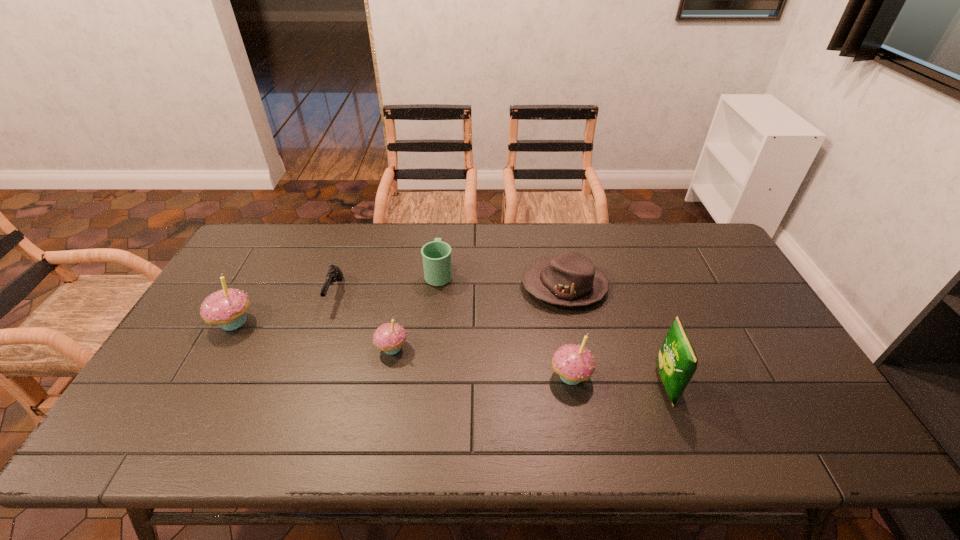
Find the location of `free point located 0.250m on the back of the leftmost cupcake`. free point located 0.250m on the back of the leftmost cupcake is located at coordinates (272, 254).

Where is `free space located on the right of the third object from left to right`? free space located on the right of the third object from left to right is located at coordinates (538, 348).

This screenshot has height=540, width=960. Identify the location of blank space located on the back of the rightmost cupcake. (552, 272).

Identify the location of free location located at the end of the barrel of the gun. (297, 402).

You are a GUI agent. You are given a task and a screenshot of the screen. Output one action in this format:
    pyautogui.click(x=<x>, y=<y>)
    Task: Click on the free location located 0.130m on the side of the mug with the handle
    
    Given the screenshot: What is the action you would take?
    pyautogui.click(x=443, y=237)

You are a GUI agent. You are given a task and a screenshot of the screen. Output one action in this format:
    pyautogui.click(x=<x>, y=<y>)
    Task: Click on the vacant space located on the side of the mug with the handle
    The image size is (960, 540).
    Given the screenshot: What is the action you would take?
    pyautogui.click(x=443, y=241)

Find the location of a particular element. The image size is (960, 540). vacant space located on the side of the mug with the handle is located at coordinates (444, 224).

The height and width of the screenshot is (540, 960). Find the location of `vacant area situated 0.120m on the decorative side of the hat`. vacant area situated 0.120m on the decorative side of the hat is located at coordinates (482, 286).

Where is `vacant space situated 0.360m on the decorative side of the hat`? This screenshot has width=960, height=540. vacant space situated 0.360m on the decorative side of the hat is located at coordinates (405, 286).

Find the location of `vacant region located 0.200m on the decorative side of the hat`. vacant region located 0.200m on the decorative side of the hat is located at coordinates (457, 286).